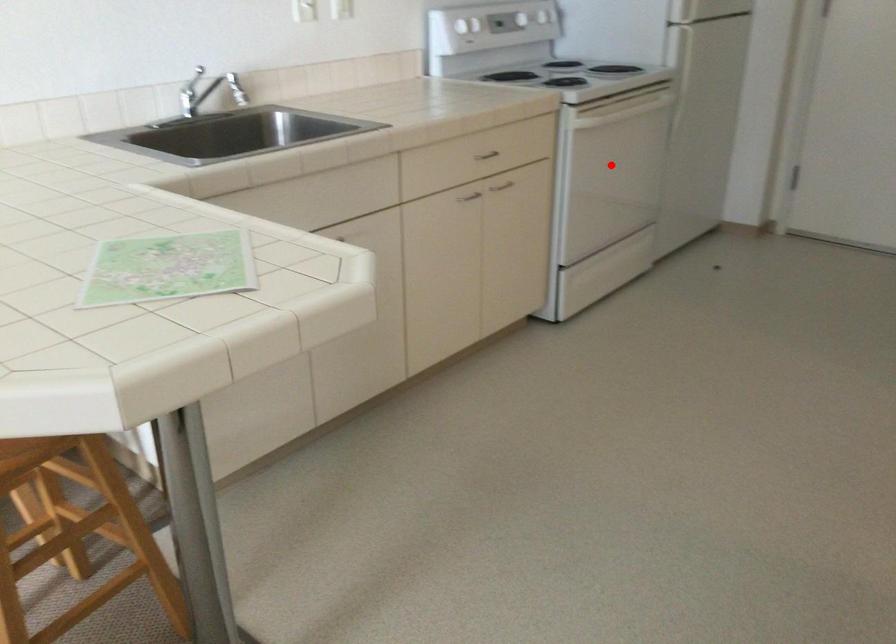
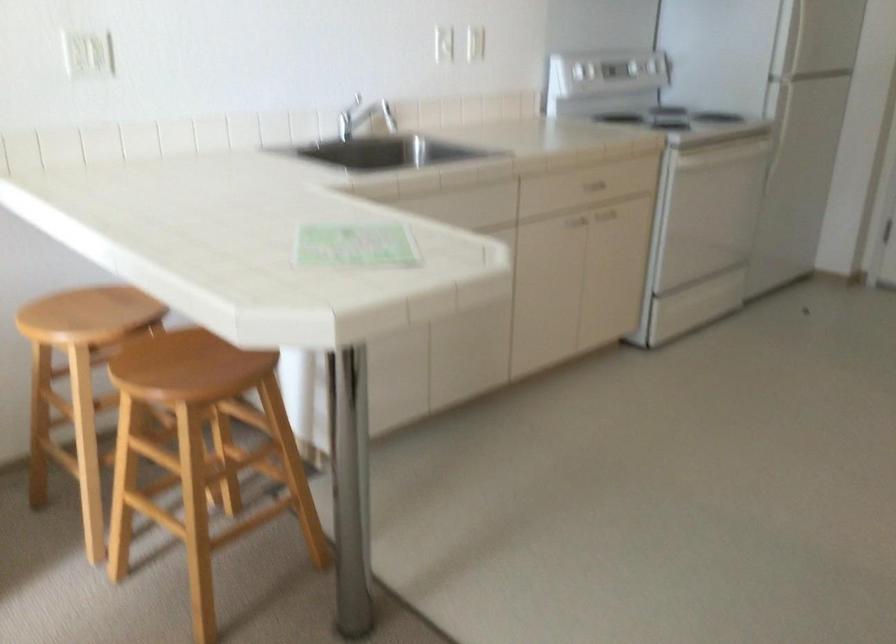
Where in the second image is the point corresponding to the highlighted location from the first image?

(714, 202)